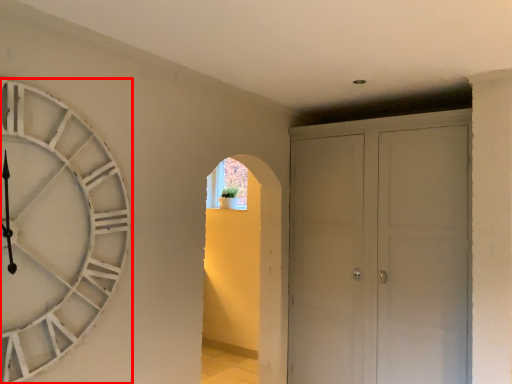
Question: From the image's perspective, considering the relative positions of wall clock (annotated by the red box) and door in the image provided, where is wall clock (annotated by the red box) located with respect to the staircase?

Choices:
 (A) below
 (B) above

Answer: (B)